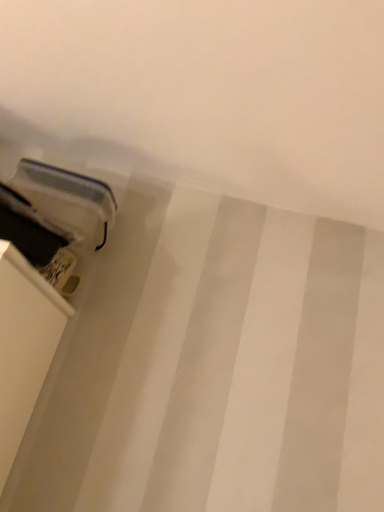
Question: Can you confirm if matte plastic shelf at lower left is shorter than matte plastic container at lower left?

Choices:
 (A) no
 (B) yes

Answer: (B)

Question: From the image's perspective, would you say matte plastic shelf at lower left is positioned over matte plastic container at lower left?

Choices:
 (A) yes
 (B) no

Answer: (B)

Question: Considering the relative sizes of matte plastic shelf at lower left and matte plastic container at lower left in the image provided, is matte plastic shelf at lower left bigger than matte plastic container at lower left?

Choices:
 (A) yes
 (B) no

Answer: (B)

Question: From a real-world perspective, is matte plastic shelf at lower left located higher than matte plastic container at lower left?

Choices:
 (A) no
 (B) yes

Answer: (A)

Question: Is matte plastic shelf at lower left behind matte plastic container at lower left?

Choices:
 (A) yes
 (B) no

Answer: (B)

Question: Would you say matte plastic shelf at lower left is outside matte plastic container at lower left?

Choices:
 (A) no
 (B) yes

Answer: (B)

Question: Can you confirm if matte plastic container at lower left is smaller than matte plastic shelf at lower left?

Choices:
 (A) yes
 (B) no

Answer: (B)

Question: Is matte plastic container at lower left to the right of matte plastic shelf at lower left from the viewer's perspective?

Choices:
 (A) yes
 (B) no

Answer: (A)

Question: Does matte plastic container at lower left have a greater height compared to matte plastic shelf at lower left?

Choices:
 (A) no
 (B) yes

Answer: (B)

Question: Is matte plastic container at lower left far from matte plastic shelf at lower left?

Choices:
 (A) yes
 (B) no

Answer: (B)

Question: From a real-world perspective, does matte plastic container at lower left sit lower than matte plastic shelf at lower left?

Choices:
 (A) yes
 (B) no

Answer: (B)

Question: Can we say matte plastic container at lower left lies outside matte plastic shelf at lower left?

Choices:
 (A) yes
 (B) no

Answer: (A)

Question: From a real-world perspective, is matte plastic container at lower left physically located above or below matte plastic shelf at lower left?

Choices:
 (A) below
 (B) above

Answer: (B)